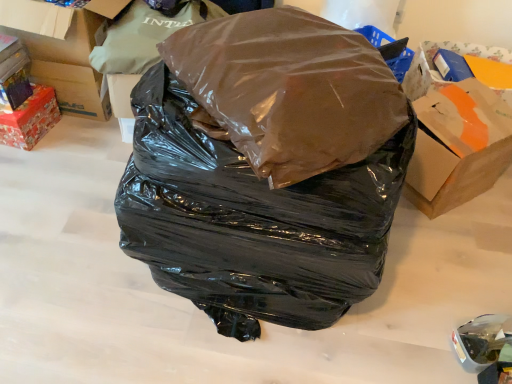
Question: Does brown matte plastic bag at center, which is the 2th plastic bag in top-to-bottom order, have a greater width compared to brown matte plastic bag at center, which is counted as the 3th plastic bag, starting from the top?

Choices:
 (A) yes
 (B) no

Answer: (B)

Question: Does brown matte plastic bag at center, which is counted as the 2th plastic bag, starting from the bottom, turn towards brown matte plastic bag at center, placed as the 1th plastic bag when sorted from bottom to top?

Choices:
 (A) no
 (B) yes

Answer: (A)

Question: Is brown matte plastic bag at center, which is the 2th plastic bag in top-to-bottom order, not within brown matte plastic bag at center, placed as the 1th plastic bag when sorted from bottom to top?

Choices:
 (A) yes
 (B) no

Answer: (A)

Question: Is brown matte plastic bag at center, which is counted as the 2th plastic bag, starting from the bottom, oriented away from brown matte plastic bag at center, placed as the 1th plastic bag when sorted from bottom to top?

Choices:
 (A) no
 (B) yes

Answer: (A)

Question: From the image's perspective, is brown matte plastic bag at center, which is the 2th plastic bag in top-to-bottom order, below brown matte plastic bag at center, which is counted as the 3th plastic bag, starting from the top?

Choices:
 (A) yes
 (B) no

Answer: (B)

Question: Is there a large distance between brown matte plastic bag at center, which is the 2th plastic bag in top-to-bottom order, and brown matte plastic bag at center, which is counted as the 3th plastic bag, starting from the top?

Choices:
 (A) yes
 (B) no

Answer: (B)

Question: Is matte cardboard box at left, placed as the first box when sorted from top to bottom, positioned beyond the bounds of shiny metallic box at left, acting as the 2th box starting from the top?

Choices:
 (A) yes
 (B) no

Answer: (A)

Question: Is matte cardboard box at left, the 2th box in the bottom-to-top sequence, positioned far away from shiny metallic box at left, acting as the 2th box starting from the top?

Choices:
 (A) no
 (B) yes

Answer: (A)

Question: Is matte cardboard box at left, the 2th box in the bottom-to-top sequence, aimed at shiny metallic box at left, acting as the 2th box starting from the top?

Choices:
 (A) no
 (B) yes

Answer: (B)

Question: Is matte cardboard box at left, placed as the first box when sorted from top to bottom, to the right of shiny metallic box at left, acting as the 2th box starting from the top, from the viewer's perspective?

Choices:
 (A) no
 (B) yes

Answer: (B)

Question: Is matte cardboard box at left, the 2th box in the bottom-to-top sequence, thinner than shiny metallic box at left, the first box in the bottom-to-top sequence?

Choices:
 (A) yes
 (B) no

Answer: (B)

Question: Is matte cardboard box at left, placed as the first box when sorted from top to bottom, at the left side of shiny metallic box at left, the first box in the bottom-to-top sequence?

Choices:
 (A) no
 (B) yes

Answer: (A)

Question: Could you tell me if matte cardboard box at left, placed as the first box when sorted from top to bottom, is turned towards brown matte plastic bag at center, which is counted as the 3th plastic bag, starting from the top?

Choices:
 (A) no
 (B) yes

Answer: (A)